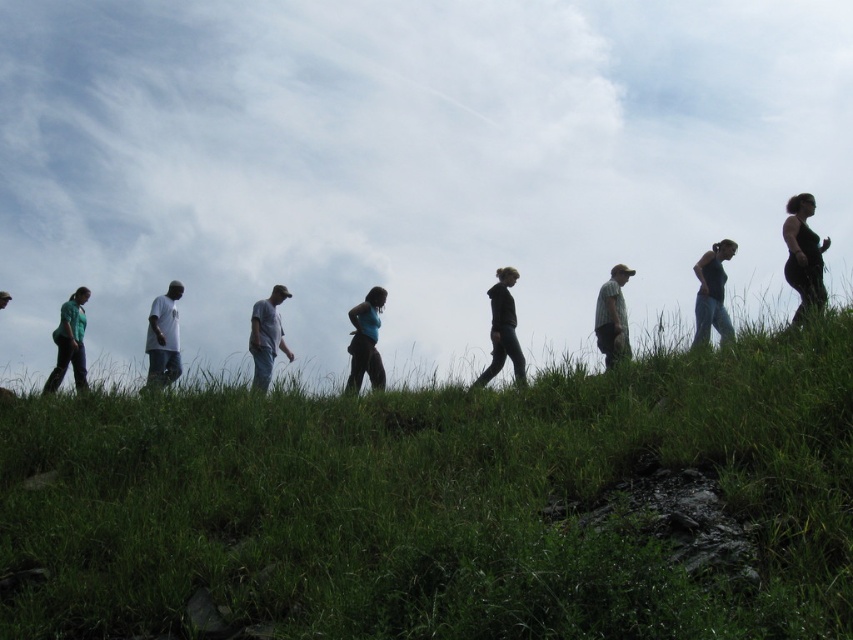
You are standing on the grassy hill and want to find the white cotton shirt at left and the matte green shirt at center. Based on their positions, which shirt is closer to the bottom of the hill?

The white cotton shirt at left is below the matte green shirt at center, so it is closer to the bottom of the hill.

You are a photographer trying to capture a group photo of the nine individuals on the grassy hill. You notice two shirts at the left side of the frame, a white cotton shirt at left and a green fabric shirt at left. Which shirt should you adjust to ensure both are visible in the photo?

The white cotton shirt at left is smaller than the green fabric shirt at left. To ensure both are visible, adjust the white cotton shirt at left so it doesn not get obscured by the larger green fabric shirt at left.